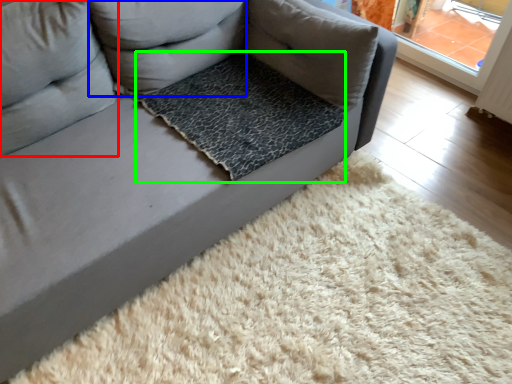
Question: Considering the real-world distances, which object is farthest from pillow (highlighted by a red box)? pillow (highlighted by a blue box) or dog bed (highlighted by a green box)?

Choices:
 (A) pillow
 (B) dog bed

Answer: (B)